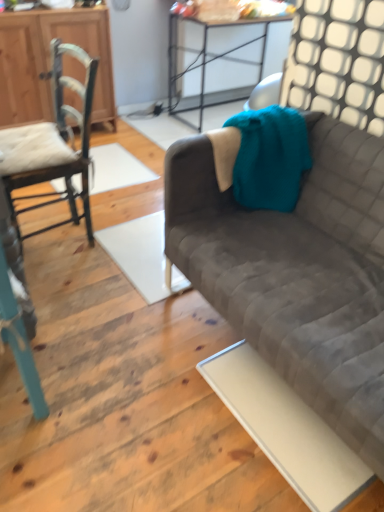
Question: Can you confirm if wooden cabinet at left is smaller than teal wooden chair at left, the second chair positioned from the back?

Choices:
 (A) no
 (B) yes

Answer: (A)

Question: Could you tell me if wooden cabinet at left is turned towards teal wooden chair at left, the 1th chair viewed from the front?

Choices:
 (A) yes
 (B) no

Answer: (A)

Question: Can you confirm if wooden cabinet at left is taller than teal wooden chair at left, the 1th chair viewed from the front?

Choices:
 (A) no
 (B) yes

Answer: (A)

Question: Is wooden cabinet at left wider than teal wooden chair at left, the 1th chair viewed from the front?

Choices:
 (A) no
 (B) yes

Answer: (A)

Question: From the image's perspective, is wooden cabinet at left under teal wooden chair at left, the 1th chair viewed from the front?

Choices:
 (A) yes
 (B) no

Answer: (B)

Question: Looking at the image, does velvet gray couch at right seem bigger or smaller compared to wooden cabinet at left?

Choices:
 (A) small
 (B) big

Answer: (B)

Question: In terms of height, does velvet gray couch at right look taller or shorter compared to wooden cabinet at left?

Choices:
 (A) short
 (B) tall

Answer: (A)

Question: In the image, is velvet gray couch at right on the left side or the right side of wooden cabinet at left?

Choices:
 (A) right
 (B) left

Answer: (A)

Question: From a real-world perspective, is velvet gray couch at right above or below wooden cabinet at left?

Choices:
 (A) below
 (B) above

Answer: (A)

Question: Is wooden cabinet at left bigger or smaller than wooden chair at left, which appears as the 2th chair when viewed from the front?

Choices:
 (A) big
 (B) small

Answer: (A)

Question: From their relative heights in the image, would you say wooden cabinet at left is taller or shorter than wooden chair at left, placed as the 1th chair when sorted from back to front?

Choices:
 (A) short
 (B) tall

Answer: (B)

Question: Does point tap(107, 22) appear closer or farther from the camera than point tap(19, 231)?

Choices:
 (A) closer
 (B) farther

Answer: (B)

Question: Considering the positions of wooden cabinet at left and wooden chair at left, which appears as the 2th chair when viewed from the front, in the image, is wooden cabinet at left wider or thinner than wooden chair at left, which appears as the 2th chair when viewed from the front,?

Choices:
 (A) thin
 (B) wide

Answer: (A)

Question: Looking at their shapes, would you say wooden cabinet at left is wider or thinner than metallic silver table at upper center?

Choices:
 (A) wide
 (B) thin

Answer: (B)

Question: In the image, is wooden cabinet at left positioned in front of or behind metallic silver table at upper center?

Choices:
 (A) behind
 (B) front

Answer: (B)